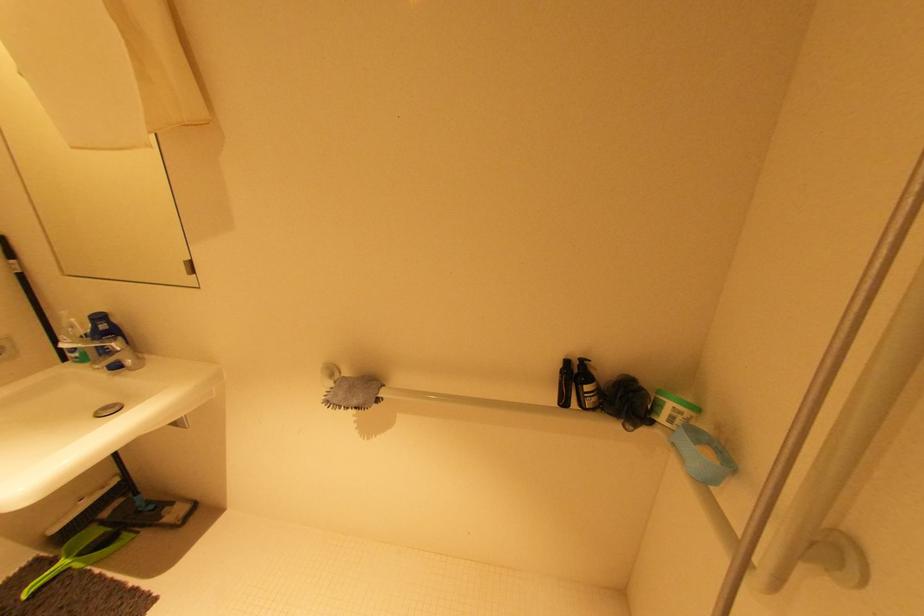
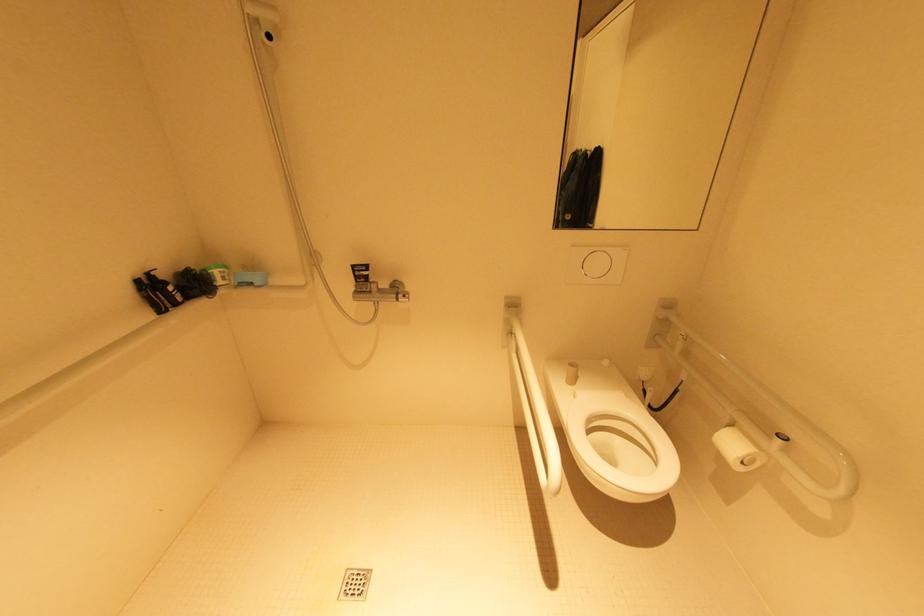
Based on the continuous images, in which direction is the camera rotating?

The camera's rotation is toward right-down.